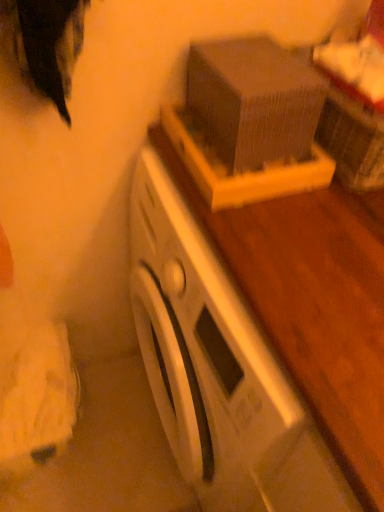
Question: From the image's perspective, is white matte washing machine at center located above or below wooden box at upper center?

Choices:
 (A) below
 (B) above

Answer: (A)

Question: From a real-world perspective, relative to wooden box at upper center, is white matte washing machine at center vertically above or below?

Choices:
 (A) below
 (B) above

Answer: (A)

Question: Considering the positions of white matte washing machine at center and wooden box at upper center in the image, is white matte washing machine at center wider or thinner than wooden box at upper center?

Choices:
 (A) wide
 (B) thin

Answer: (A)

Question: Visually, is wooden box at upper center positioned to the left or to the right of white matte washing machine at center?

Choices:
 (A) right
 (B) left

Answer: (B)

Question: Is wooden box at upper center wider or thinner than white matte washing machine at center?

Choices:
 (A) thin
 (B) wide

Answer: (A)

Question: Is wooden box at upper center inside or outside of white matte washing machine at center?

Choices:
 (A) outside
 (B) inside

Answer: (A)

Question: In terms of size, does wooden box at upper center appear bigger or smaller than white matte washing machine at center?

Choices:
 (A) big
 (B) small

Answer: (B)